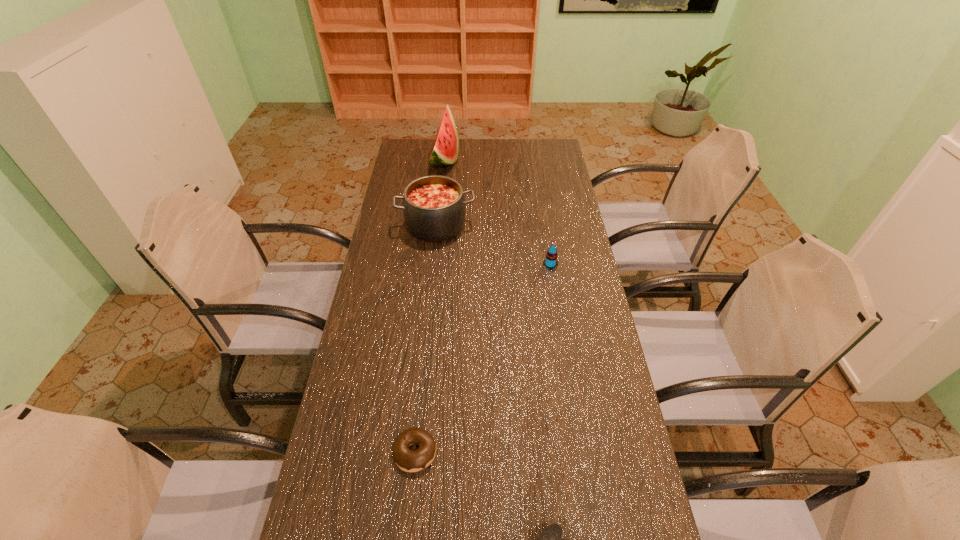
At what (x,y) coordinates should I click in order to perform the action: click on free space that satisfies the following two spatial constraints: 1. on the outer rind of the doughnut; 2. on the left side of the farthest object. Please return your answer as a coordinate pair (x, y). Image resolution: width=960 pixels, height=540 pixels. Looking at the image, I should click on click(414, 452).

The height and width of the screenshot is (540, 960). I want to click on vacant region that satisfies the following two spatial constraints: 1. on the outer rind of the watermelon; 2. on the right side of the third tallest object, so click(x=433, y=265).

The height and width of the screenshot is (540, 960). I want to click on free space that satisfies the following two spatial constraints: 1. on the outer rind of the doughnut; 2. on the right side of the farthest object, so click(x=414, y=452).

You are a GUI agent. You are given a task and a screenshot of the screen. Output one action in this format:
    pyautogui.click(x=<x>, y=<y>)
    Task: Click on the vacant space that satisfies the following two spatial constraints: 1. on the back side of the shortest object; 2. on the left side of the third tallest object
    
    Given the screenshot: What is the action you would take?
    pyautogui.click(x=434, y=265)

Locate an element on the screen. This screenshot has height=540, width=960. free region that satisfies the following two spatial constraints: 1. on the outer rind of the tallest object; 2. on the left side of the third shortest object is located at coordinates (433, 265).